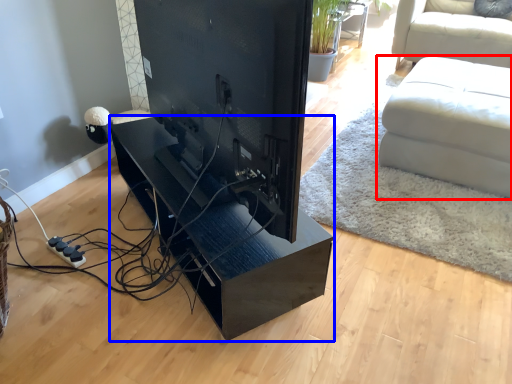
Question: Which object appears closest to the camera in this image, studio couch (highlighted by a red box) or table (highlighted by a blue box)?

Choices:
 (A) studio couch
 (B) table

Answer: (B)